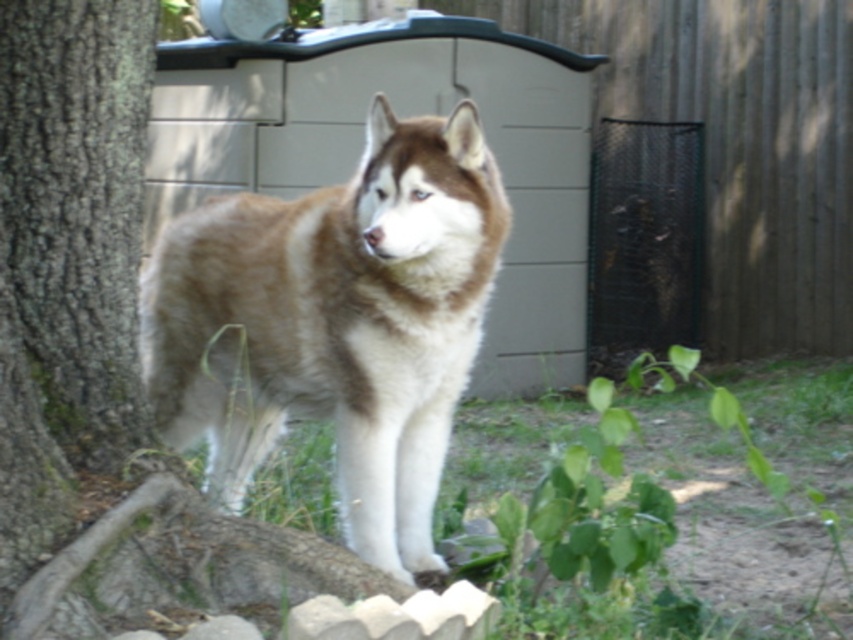
You are a dog owner who wants to ensure your Siberian Husky stays within a safe distance from the tree trunk to prevent it from chewing on the bark. Based on the image, what is the minimum distance you should keep between the brown and white fur at center and the brown rough tree trunk at left?

The minimum distance you should keep between the brown and white fur at center and the brown rough tree trunk at left is 62.41 centimeters, as they are currently 62.41 centimeters apart.

You are a dog owner trying to decide where to place a new dog bed in your backyard. You want the bed to be at the same height as the brown and white fur at center but also near the brown rough tree trunk at left. Is this possible given their current positions?

The brown and white fur at center has a lesser height compared to the brown rough tree trunk at left. Therefore, placing the dog bed at the same height as the brown and white fur at center near the tree trunk is possible since the tree trunk is taller and won

From the picture: You are a dog owner trying to locate your Siberian Husky in the backyard. You see the brown rough tree trunk at left and the brown and white fur at center. Which object is closer to the right side of the frame?

The brown and white fur at center is positioned on the right side of brown rough tree trunk at left, so the brown and white fur at center is closer to the right side of the frame.